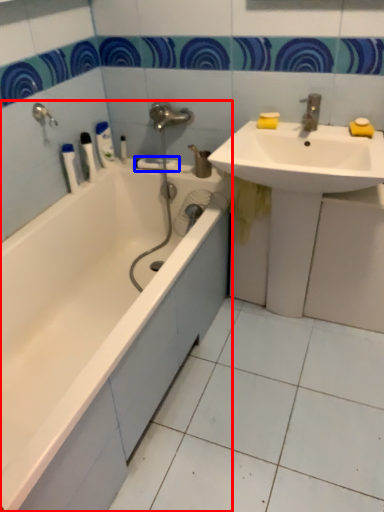
Question: Which object is closer to the camera taking this photo, bathtub (highlighted by a red box) or towel bar (highlighted by a blue box)?

Choices:
 (A) bathtub
 (B) towel bar

Answer: (A)